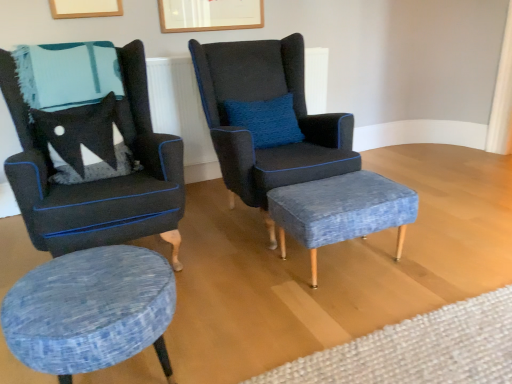
Question: Is velvet dark blue armchair at center, the 2th chair when ordered from left to right, outside textured blue fabric stool at lower left, placed as the 1th stool when sorted from front to back?

Choices:
 (A) yes
 (B) no

Answer: (A)

Question: Is velvet dark blue armchair at center, the 2th chair when ordered from left to right, further to the viewer compared to textured blue fabric stool at lower left, the second stool viewed from the right?

Choices:
 (A) yes
 (B) no

Answer: (A)

Question: From the image's perspective, is velvet dark blue armchair at center, placed as the 1th chair when sorted from right to left, below textured blue fabric stool at lower left, placed as the 1th stool when sorted from front to back?

Choices:
 (A) yes
 (B) no

Answer: (B)

Question: Is velvet dark blue armchair at center, the 2th chair when ordered from left to right, at the left side of textured blue fabric stool at lower left, the second stool viewed from the right?

Choices:
 (A) no
 (B) yes

Answer: (A)

Question: Can you confirm if velvet dark blue armchair at center, placed as the 1th chair when sorted from right to left, is shorter than textured blue fabric stool at lower left, the second stool viewed from the right?

Choices:
 (A) yes
 (B) no

Answer: (B)

Question: Is velvet dark blue armchair at center, the 2th chair when ordered from left to right, oriented away from textured blue fabric stool at lower left, positioned as the first stool in left-to-right order?

Choices:
 (A) no
 (B) yes

Answer: (A)

Question: Considering the relative sizes of blue fabric stool at center, the 1th stool viewed from the back, and textured blue fabric stool at lower left, positioned as the first stool in left-to-right order, in the image provided, is blue fabric stool at center, the 1th stool viewed from the back, shorter than textured blue fabric stool at lower left, positioned as the first stool in left-to-right order,?

Choices:
 (A) no
 (B) yes

Answer: (B)

Question: Is blue fabric stool at center, marked as the 2th stool in a left-to-right arrangement, smaller than textured blue fabric stool at lower left, arranged as the 2th stool when viewed from the back?

Choices:
 (A) no
 (B) yes

Answer: (B)

Question: Are blue fabric stool at center, marked as the 2th stool in a left-to-right arrangement, and textured blue fabric stool at lower left, the second stool viewed from the right, making contact?

Choices:
 (A) yes
 (B) no

Answer: (B)

Question: Does blue fabric stool at center, which appears as the 2th stool when viewed from the front, lie in front of textured blue fabric stool at lower left, the second stool viewed from the right?

Choices:
 (A) yes
 (B) no

Answer: (B)

Question: From the image's perspective, is blue fabric stool at center, which appears as the 1th stool when viewed from the right, located beneath textured blue fabric stool at lower left, placed as the 1th stool when sorted from front to back?

Choices:
 (A) no
 (B) yes

Answer: (A)

Question: Is blue fabric stool at center, which appears as the 1th stool when viewed from the right, oriented away from textured blue fabric stool at lower left, arranged as the 2th stool when viewed from the back?

Choices:
 (A) no
 (B) yes

Answer: (A)

Question: Can you confirm if textured blue fabric stool at lower left, placed as the 1th stool when sorted from front to back, is thinner than blue textured ottoman at center, which appears as the 1th plain when viewed from the front?

Choices:
 (A) no
 (B) yes

Answer: (B)